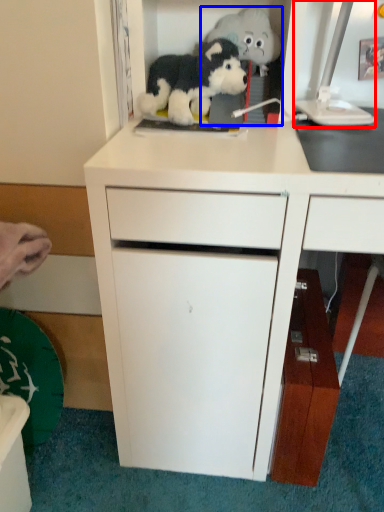
Question: Which point is further to the camera, computer monitor (highlighted by a red box) or toy (highlighted by a blue box)?

Choices:
 (A) computer monitor
 (B) toy

Answer: (B)